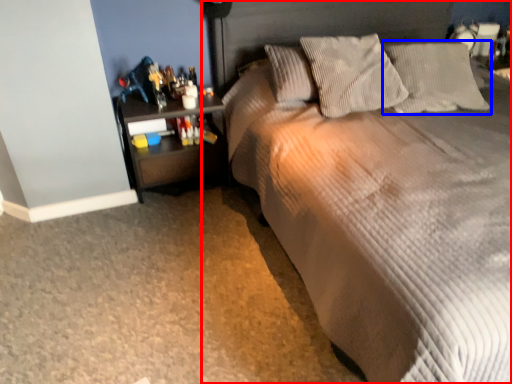
Question: Which object appears closest to the camera in this image, bed (highlighted by a red box) or pillow (highlighted by a blue box)?

Choices:
 (A) bed
 (B) pillow

Answer: (A)